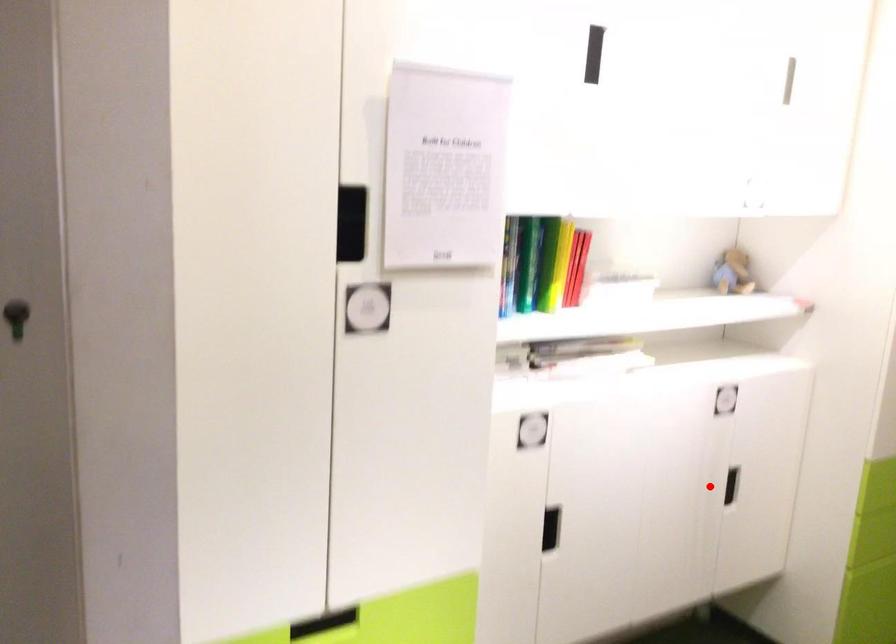
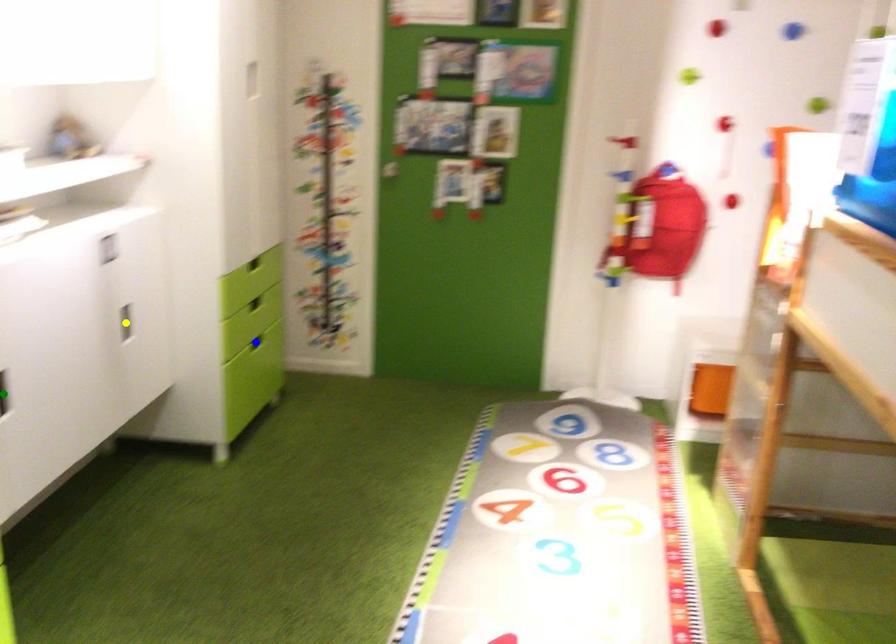
Question: I am providing you with two images of the same scene from different viewpoints. A red point is marked on the first image. You are given multiple points on the second image. Can you choose the point in image 2 that corresponds to the point in image 1?

Choices:
 (A) yellow point
 (B) green point
 (C) blue point

Answer: (A)